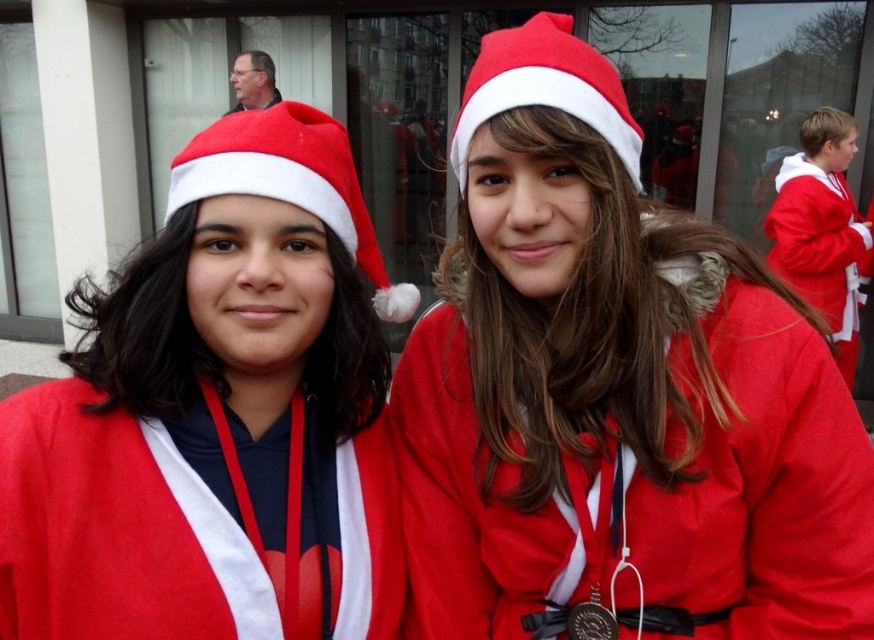
Question: Which point is closer to the camera?

Choices:
 (A) (581, 634)
 (B) (302, 264)
 (C) (481, 93)
 (D) (227, 170)

Answer: (D)

Question: Where is matte red coat at center located in relation to matte red santa hat at left in the image?

Choices:
 (A) below
 (B) above

Answer: (B)

Question: Which point is farther from the camera taking this photo?

Choices:
 (A) (608, 612)
 (B) (237, 148)
 (C) (559, 51)

Answer: (A)

Question: Which of the following is the closest to the observer?

Choices:
 (A) matte fabric santa hat at center
 (B) matte red santa hat at center
 (C) metallic gold medal at center

Answer: (A)

Question: Can you confirm if matte red coat at center is smaller than matte red santa hat at left?

Choices:
 (A) yes
 (B) no

Answer: (B)

Question: Is matte red santa hat at left above metallic gold medal at center?

Choices:
 (A) no
 (B) yes

Answer: (B)